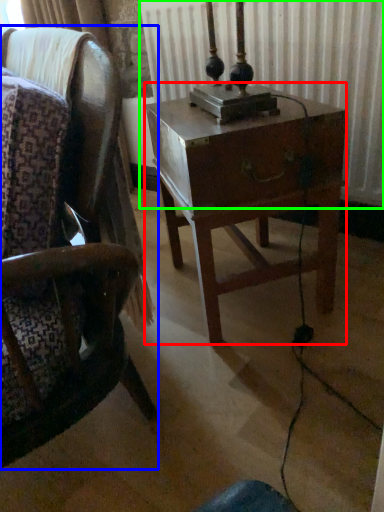
Question: Estimate the real-world distances between objects in this image. Which object is farther from nightstand (highlighted by a red box), chair (highlighted by a blue box) or radiator (highlighted by a green box)?

Choices:
 (A) chair
 (B) radiator

Answer: (B)